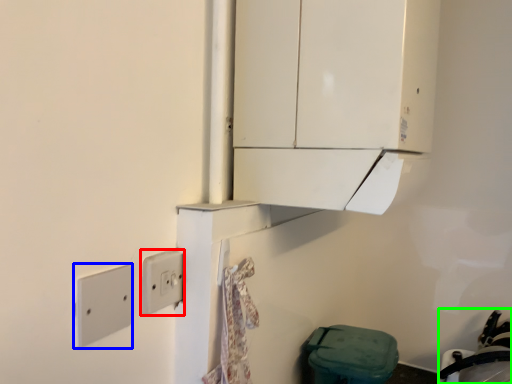
Question: Which object is positioned closest to light switch (highlighted by a red box)? Select from light switch (highlighted by a blue box) and sink (highlighted by a green box).

Choices:
 (A) light switch
 (B) sink

Answer: (A)